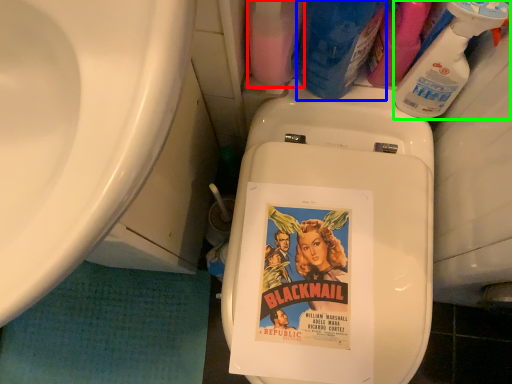
Question: Which is farther away from cleaning product (highlighted by a red box)? cleaning product (highlighted by a blue box) or cleaning product (highlighted by a green box)?

Choices:
 (A) cleaning product
 (B) cleaning product

Answer: (B)